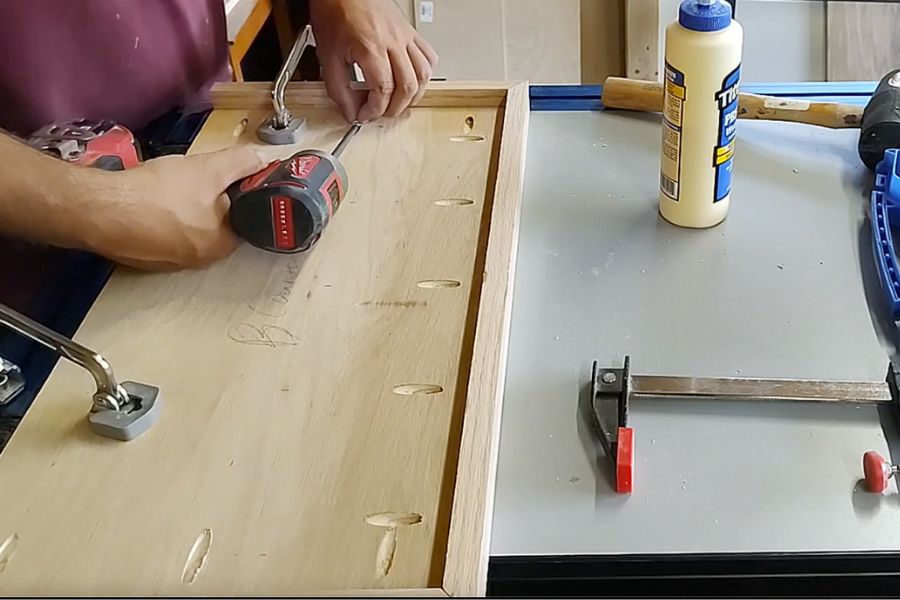
Locate an element on the screen. wall is located at coordinates pos(758,38), pos(446,25).